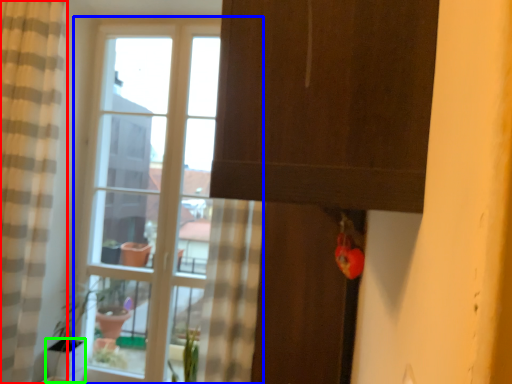
Question: Which object is positioned farthest from curtain (highlighted by a red box)? Select from window (highlighted by a blue box) and glass vase (highlighted by a green box).

Choices:
 (A) window
 (B) glass vase

Answer: (A)